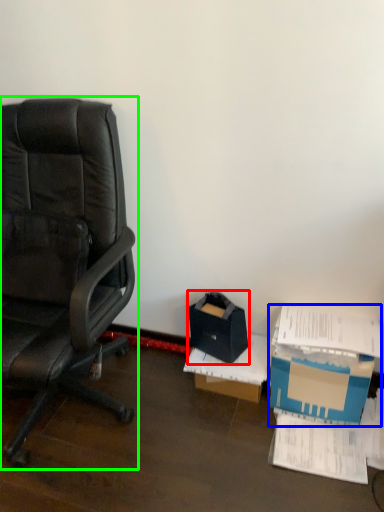
Question: Estimate the real-world distances between objects in this image. Which object is closer to storage box (highlighted by a red box), box (highlighted by a blue box) or chair (highlighted by a green box)?

Choices:
 (A) box
 (B) chair

Answer: (A)